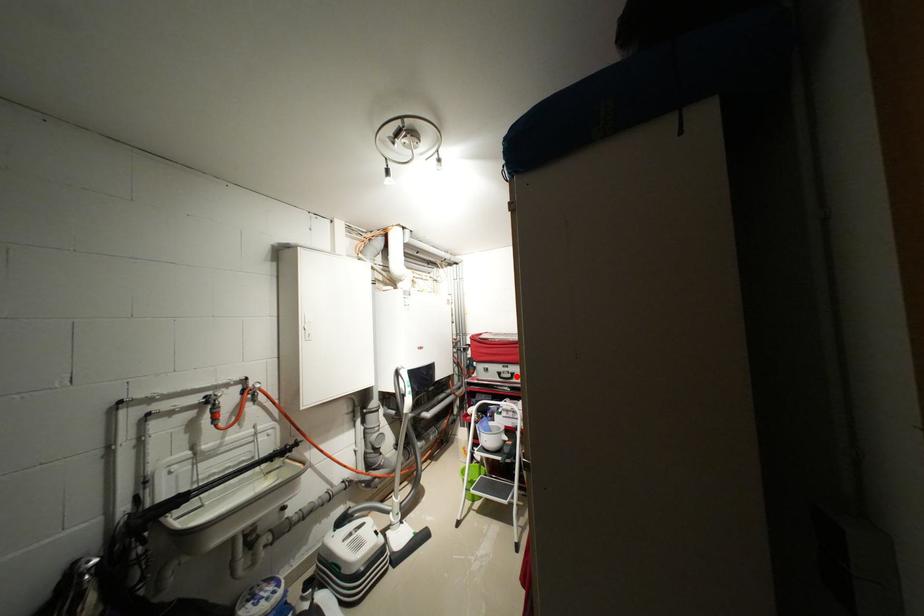
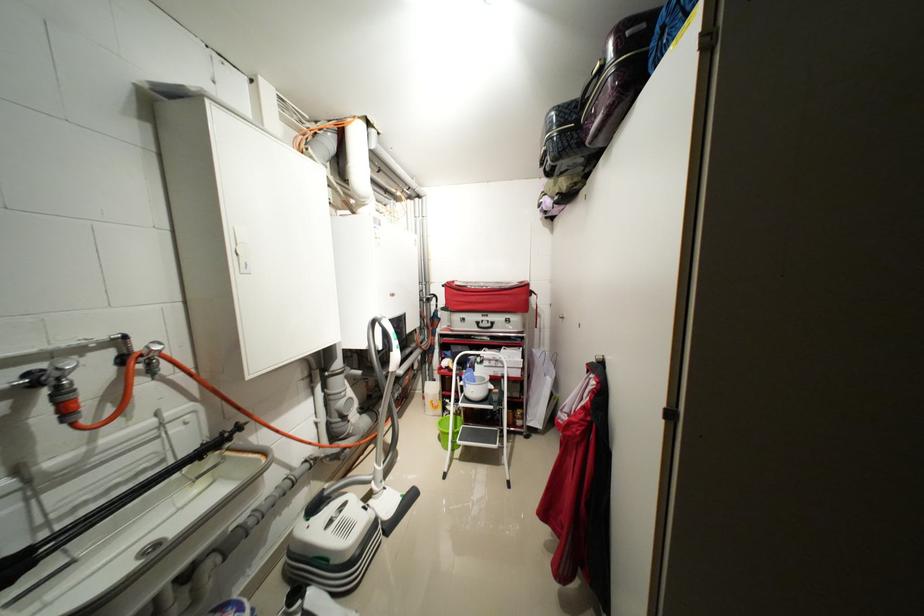
Where in the second image is the point corresponding to the highlighted location from the first image?

(496, 326)